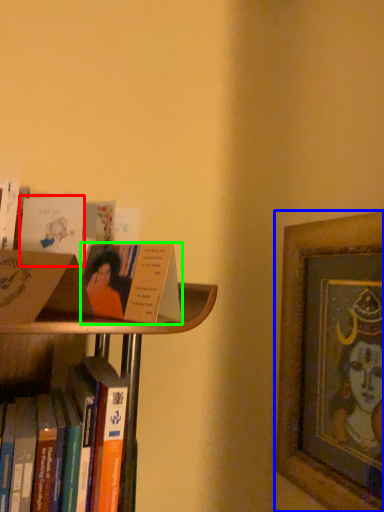
Question: Which object is positioned closest to paperback book (highlighted by a red box)? Select from picture frame (highlighted by a blue box) and book (highlighted by a green box).

Choices:
 (A) picture frame
 (B) book

Answer: (B)